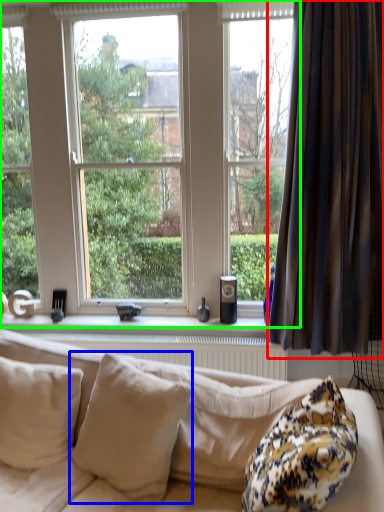
Question: Which object is the farthest from curtain (highlighted by a red box)? Choose among these: pillow (highlighted by a blue box) or window (highlighted by a green box).

Choices:
 (A) pillow
 (B) window

Answer: (A)